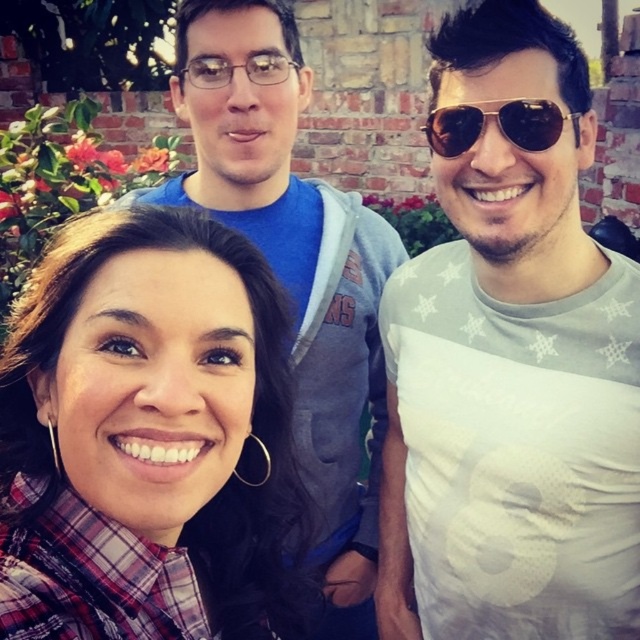
Question: Which point is closer to the camera taking this photo?

Choices:
 (A) (444, 145)
 (B) (77, 506)

Answer: (B)

Question: Which object appears farthest from the camera in this image?

Choices:
 (A) plaid fabric shirt at center
 (B) matte blue shirt at center
 (C) shiny brown aviator sunglasses at upper right

Answer: (B)

Question: Is matte blue shirt at center smaller than shiny brown aviator sunglasses at upper right?

Choices:
 (A) no
 (B) yes

Answer: (A)

Question: Can you confirm if white matte t-shirt at center is bigger than plaid fabric shirt at center?

Choices:
 (A) no
 (B) yes

Answer: (B)

Question: Can you confirm if matte blue shirt at center is smaller than shiny brown aviator sunglasses at upper right?

Choices:
 (A) no
 (B) yes

Answer: (A)

Question: Which point is closer to the camera taking this photo?

Choices:
 (A) (230, 195)
 (B) (92, 307)
 (C) (579, 632)
 (D) (445, 131)

Answer: (B)